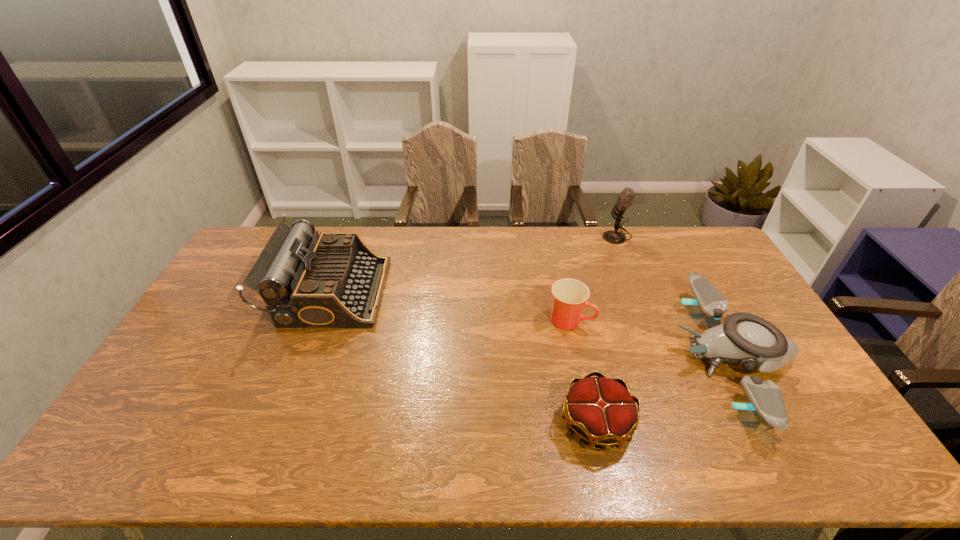
Locate an element on the screen. microphone is located at coordinates (625, 198).

Find the location of a particular element. This screenshot has height=540, width=960. the leftmost object is located at coordinates (333, 279).

Identify the location of cup. (x=570, y=296).

The width and height of the screenshot is (960, 540). Identify the location of drone. (747, 339).

Where is `crown`? crown is located at coordinates (602, 411).

At what (x,y) coordinates should I click in order to perform the action: click on vacant region located on the front-facing side of the farthest object. Please return your answer as a coordinate pair (x, y). The height and width of the screenshot is (540, 960). Looking at the image, I should click on (579, 235).

Find the location of a particular element. This screenshot has width=960, height=540. vacant region located on the front-facing side of the farthest object is located at coordinates (579, 235).

Where is `free spot located 0.350m on the front-facing side of the farthest object`? free spot located 0.350m on the front-facing side of the farthest object is located at coordinates (513, 235).

The width and height of the screenshot is (960, 540). Identify the location of vacant region located on the keyboard of the leftmost object. (468, 292).

Find the location of a particular element. vacant position located on the right of the cup is located at coordinates (614, 320).